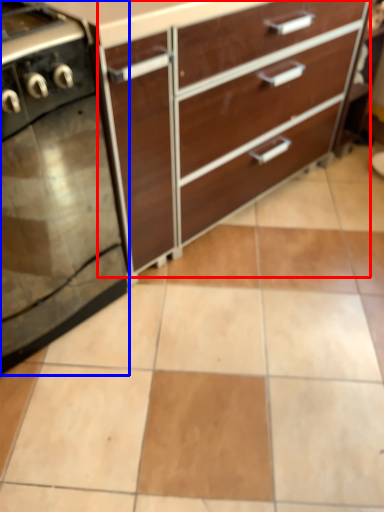
Question: Which object appears farthest to the camera in this image, chest of drawers (highlighted by a red box) or home appliance (highlighted by a blue box)?

Choices:
 (A) chest of drawers
 (B) home appliance

Answer: (A)